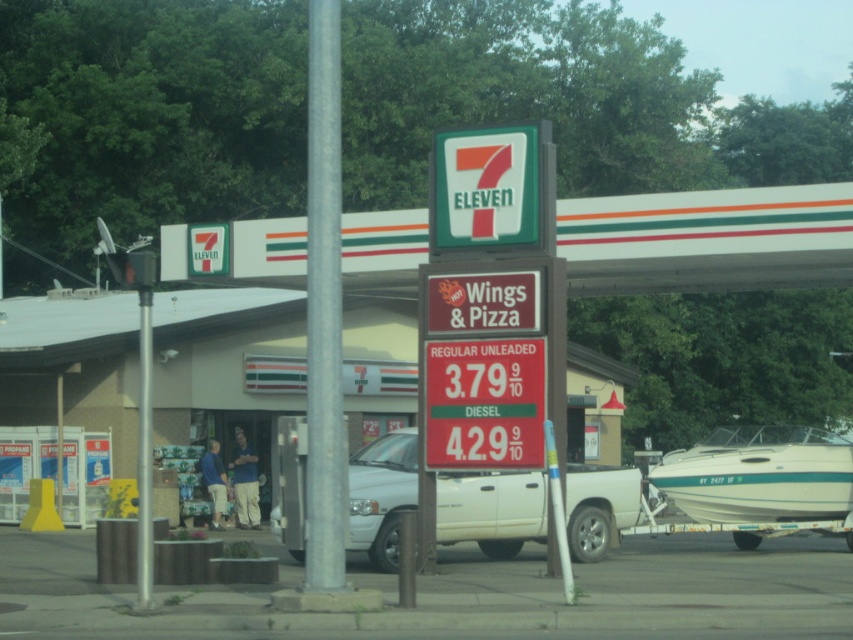
Looking at this image, you are a customer looking to park your white glossy boat at lower right near the silver metallic pole at center. Can you park the boat directly under the pole?

The silver metallic pole at center is located above the white glossy boat at lower right, so yes, the boat can be parked directly under the pole.

You are driving a car and need to check the gas prices at the 7 Eleven store. You see the green plastic sign at upper center and the metallic gray pole at left. Which object should you look at to find the gas prices?

The gas prices are listed on the metallic gray pole at left, so you should look at the metallic gray pole at left to find the gas prices.

You are a delivery driver who needs to park your truck in the parking lot of the 7 Eleven store. The parking lot has a white matte truck at center and a white glossy boat at lower right. What is the minimum distance you need to maintain between your truck and the boat to avoid blocking the entrance?

The white matte truck at center and white glossy boat at lower right are 15.71 feet apart. To avoid blocking the entrance, you should maintain at least 15.71 feet distance between your truck and the boat.